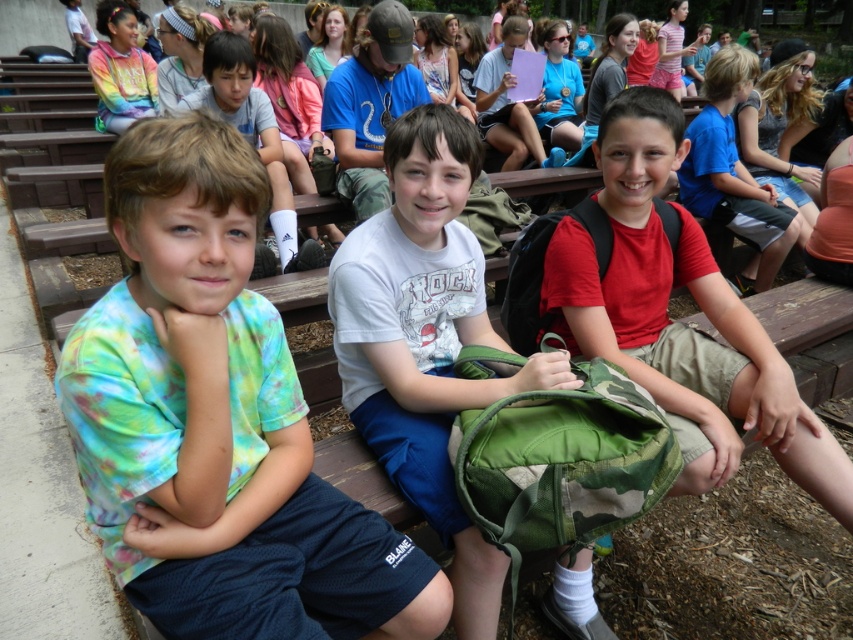
Question: Is camo fabric backpack at right thinner than tie-dye fabric shirt at upper left?

Choices:
 (A) yes
 (B) no

Answer: (A)

Question: Which point is farther to the camera?

Choices:
 (A) (708, 467)
 (B) (495, 390)

Answer: (B)

Question: Can you confirm if white cotton shirt at center is positioned above camo fabric backpack at right?

Choices:
 (A) yes
 (B) no

Answer: (B)

Question: Which of these objects is positioned closest to the white cotton shirt at center?

Choices:
 (A) tie-dye shirt at center
 (B) tie-dye fabric shirt at upper left

Answer: (A)

Question: Is the position of tie-dye shirt at left less distant than that of camo fabric backpack at right?

Choices:
 (A) no
 (B) yes

Answer: (B)

Question: Which object appears farthest from the camera in this image?

Choices:
 (A) tie-dye fabric shirt at upper left
 (B) tie-dye shirt at left
 (C) white cotton shirt at center

Answer: (A)